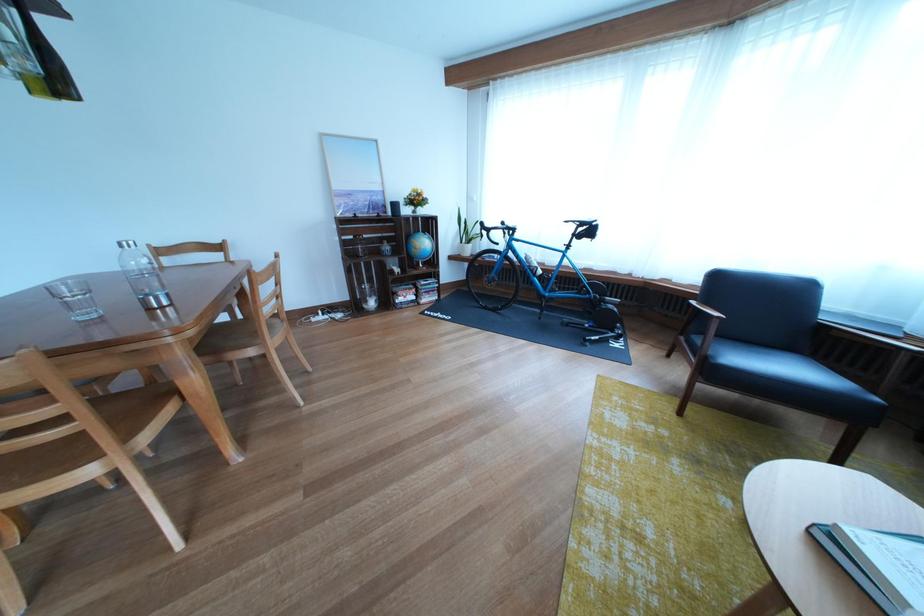
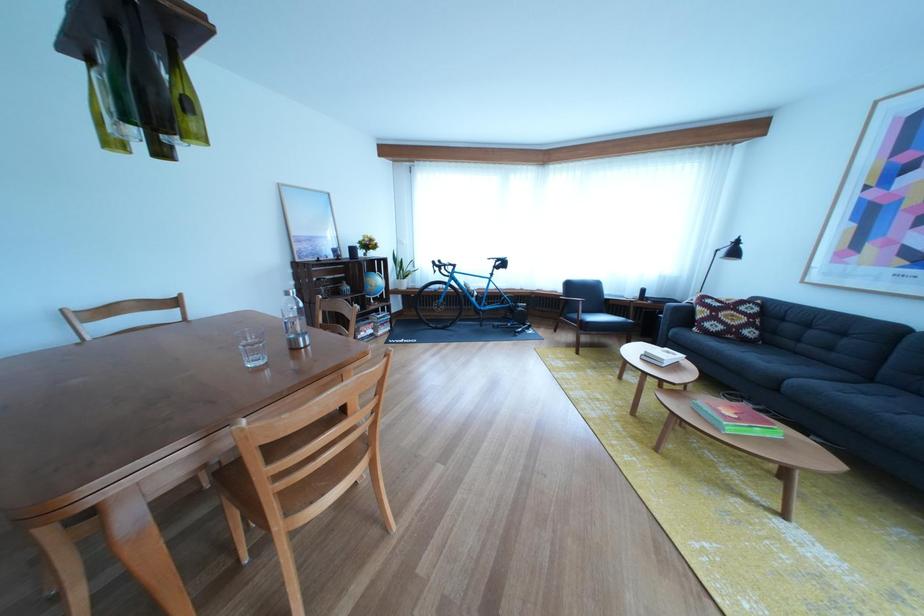
Locate, in the second image, the point that corresponds to the point at 407,257 in the first image.

(367, 297)